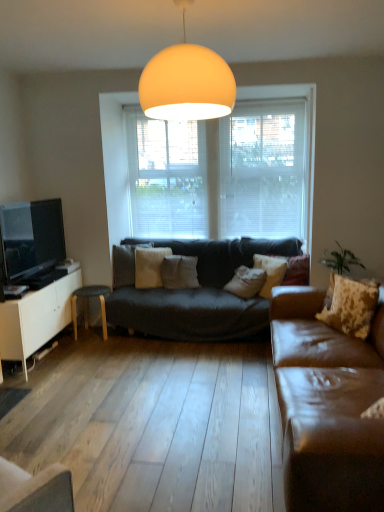
Locate an element on the screen. This screenshot has width=384, height=512. blank space situated above white cotton pillow at center, arranged as the second pillow when viewed from the left (from a real-world perspective) is located at coordinates (172, 251).